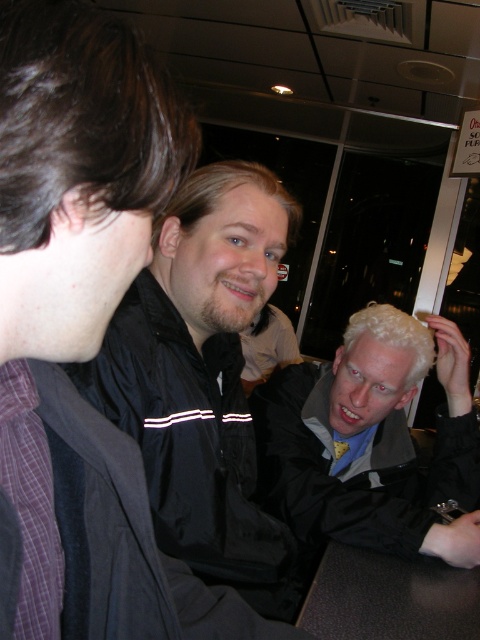
Question: Is black matte jacket at center closer to the viewer compared to brown leather table at lower center?

Choices:
 (A) yes
 (B) no

Answer: (A)

Question: Is light brown hair at center closer to camera compared to brown leather table at lower center?

Choices:
 (A) no
 (B) yes

Answer: (A)

Question: Which of the following is the farthest from the observer?

Choices:
 (A) light brown hair at center
 (B) black matte jacket at center
 (C) brown leather table at lower center

Answer: (A)

Question: Which object appears farthest from the camera in this image?

Choices:
 (A) black matte jacket at center
 (B) brown leather table at lower center
 (C) light brown hair at center

Answer: (C)

Question: In this image, where is light brown hair at center located relative to brown leather table at lower center?

Choices:
 (A) below
 (B) above

Answer: (B)

Question: Among these objects, which one is nearest to the camera?

Choices:
 (A) light brown hair at center
 (B) brown leather table at lower center

Answer: (B)